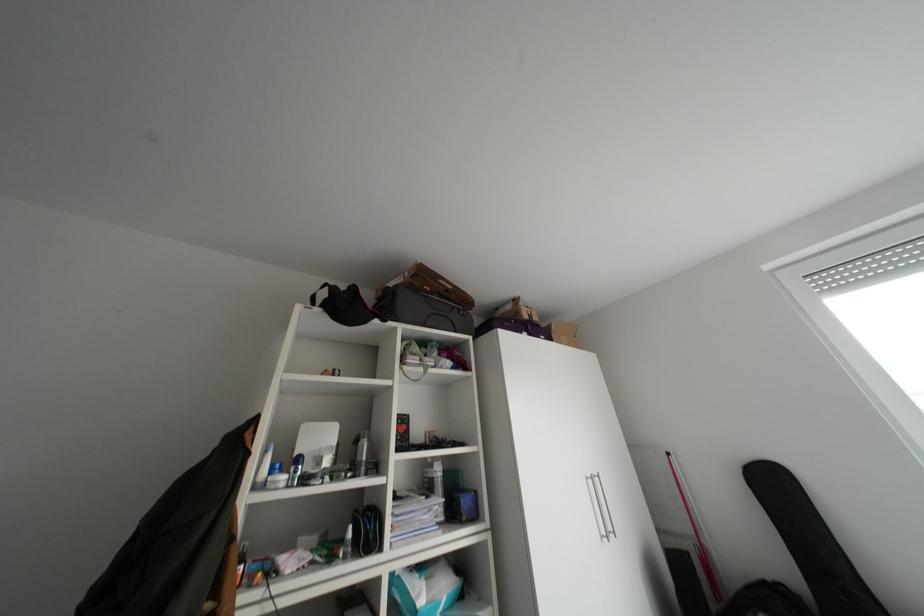
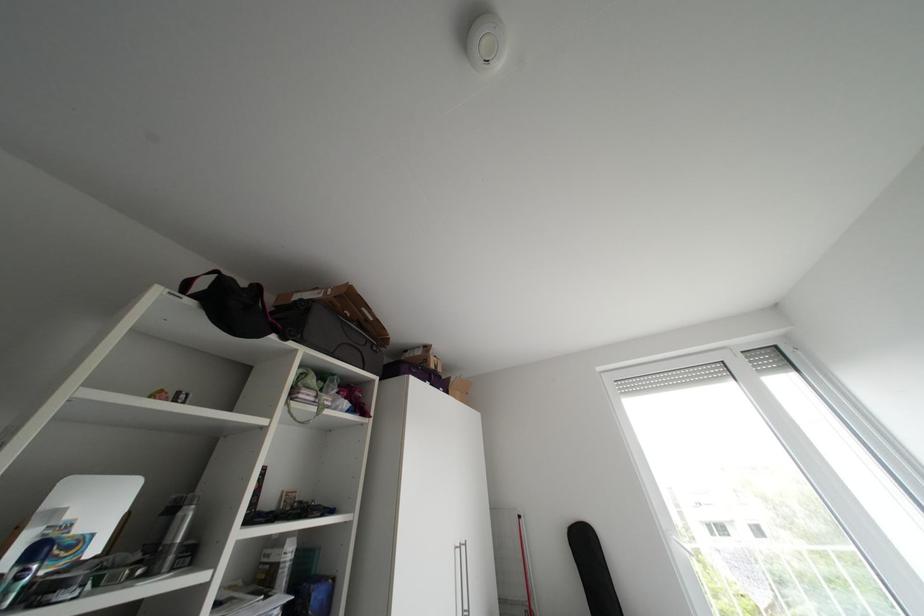
Question: The camera is either moving clockwise (left) or counter-clockwise (right) around the object. The first image is from the beginning of the video and the second image is from the end. Is the camera moving left or right when shooting the video?

Choices:
 (A) Left
 (B) Right

Answer: (A)